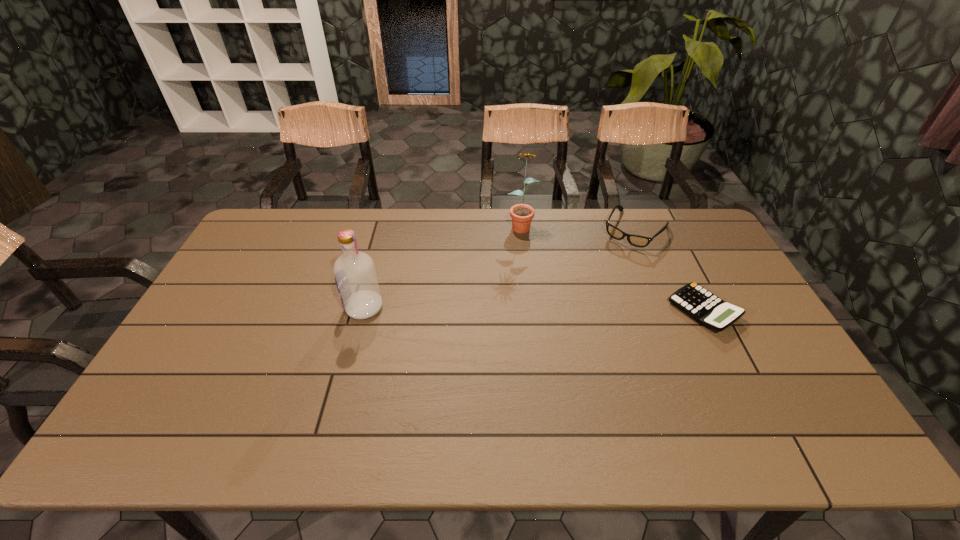
Identify the location of vacant spot on the desktop that is between the leftmost object and the calculator and is positioned on the front-facing side of the third tallest object. This screenshot has height=540, width=960. (577, 309).

Locate an element on the screen. This screenshot has height=540, width=960. free space on the desktop that is between the vodka and the shortest object and is positioned on the flower of the sunflower is located at coordinates (514, 309).